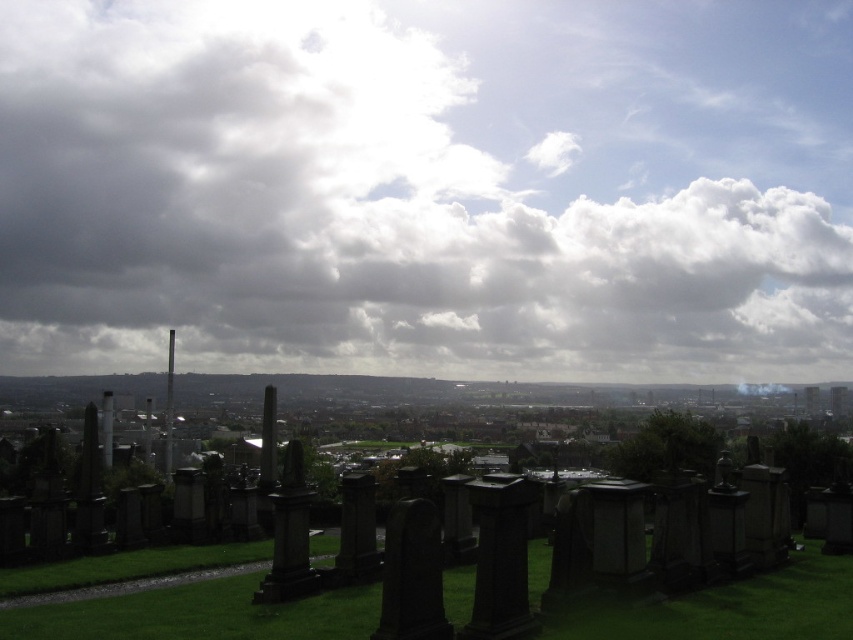
Question: Does black stone gravestones at lower center come behind green grassy at lower center?

Choices:
 (A) no
 (B) yes

Answer: (A)

Question: Which of the following is the closest to the observer?

Choices:
 (A) (0, 636)
 (B) (454, 602)
 (C) (691, 372)

Answer: (A)

Question: Estimate the real-world distances between objects in this image. Which object is farther from the cloudy sky at upper center?

Choices:
 (A) green grassy at lower center
 (B) black stone gravestones at lower center

Answer: (A)

Question: Based on their relative distances, which object is nearer to the black stone gravestones at lower center?

Choices:
 (A) cloudy sky at upper center
 (B) green grassy at lower center

Answer: (B)

Question: Is cloudy sky at upper center below black stone gravestones at lower center?

Choices:
 (A) no
 (B) yes

Answer: (A)

Question: Is black stone gravestones at lower center thinner than green grassy at lower center?

Choices:
 (A) no
 (B) yes

Answer: (A)